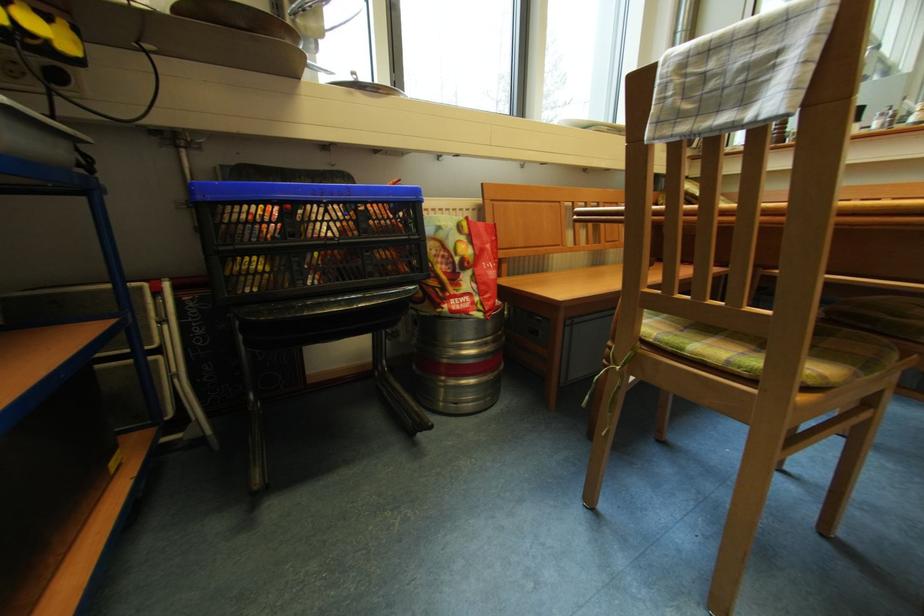
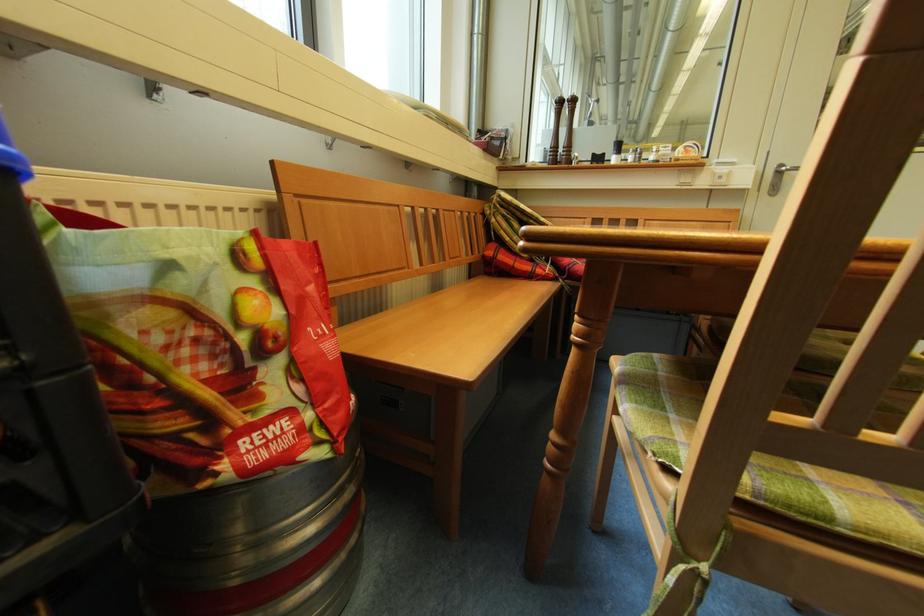
Question: The first image is from the beginning of the video and the second image is from the end. How did the camera likely rotate when shooting the video?

Choices:
 (A) Left
 (B) Right
 (C) Up
 (D) Down

Answer: (B)